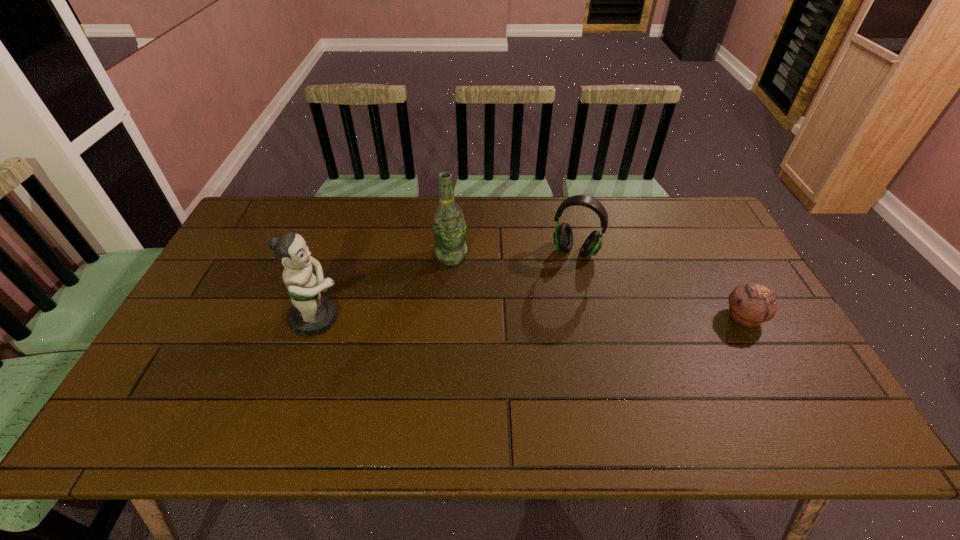
This screenshot has width=960, height=540. I want to click on the leftmost object, so [x=310, y=314].

In order to click on the shortest object in this screenshot , I will do `click(750, 305)`.

Where is `muffin`? The image size is (960, 540). muffin is located at coordinates (750, 305).

Where is `the third object from left to right`? the third object from left to right is located at coordinates click(x=563, y=237).

You are a GUI agent. You are given a task and a screenshot of the screen. Output one action in this format:
    pyautogui.click(x=<x>, y=<y>)
    Task: Click on the headset
    This screenshot has height=540, width=960.
    Given the screenshot: What is the action you would take?
    pyautogui.click(x=563, y=237)

Identify the location of beer bottle. (449, 229).

Image resolution: width=960 pixels, height=540 pixels. Find the location of `vacant space situated on the front-facing side of the figurine`. vacant space situated on the front-facing side of the figurine is located at coordinates (484, 319).

Identify the location of free spot located 0.210m on the left of the shortest object. (646, 318).

At what (x,y) coordinates should I click in order to perform the action: click on vacant area located 0.230m on the ear cups of the second object from right to left. Please return your answer as a coordinate pair (x, y). The height and width of the screenshot is (540, 960). Looking at the image, I should click on (546, 316).

Find the location of a particular element. Image resolution: width=960 pixels, height=540 pixels. free spot located on the ear cups of the second object from right to left is located at coordinates pos(540,333).